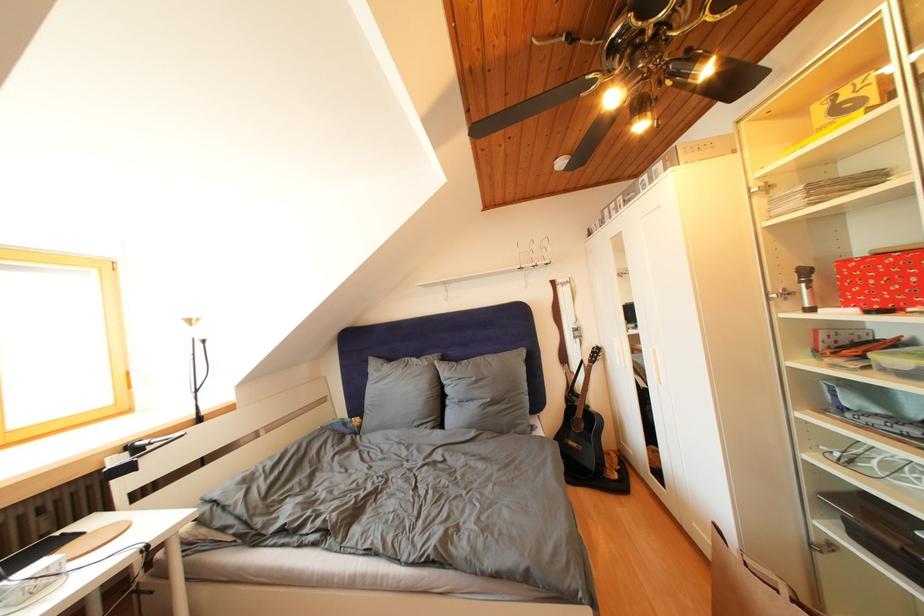
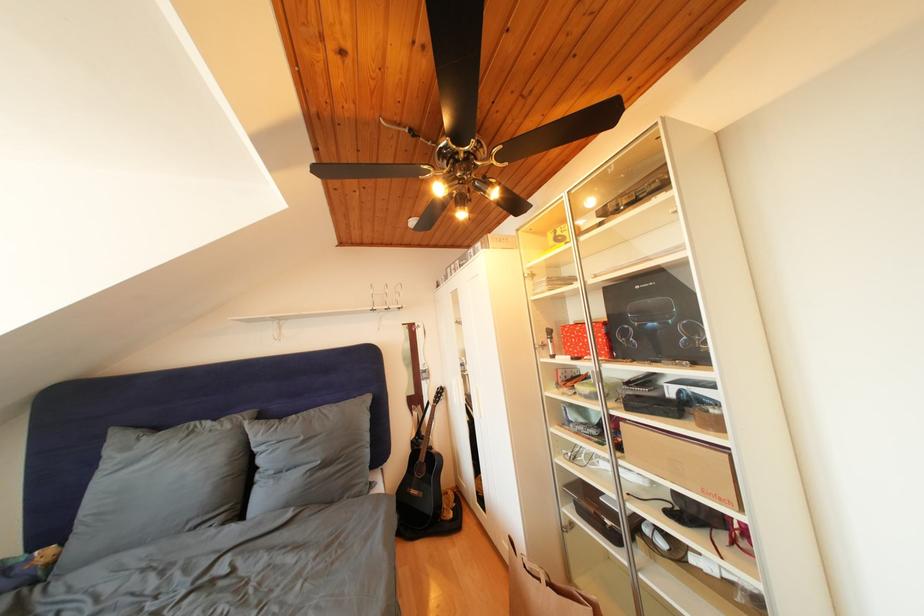
Where in the second image is the point corresponding to (821,552) from the first image?

(572, 533)